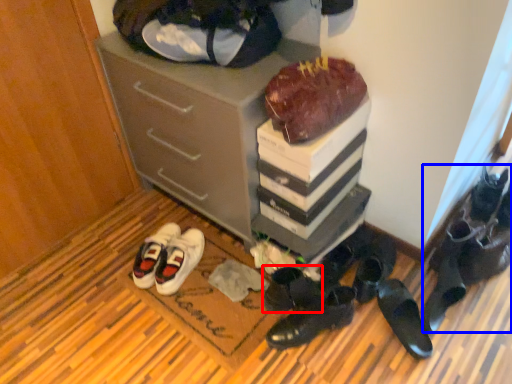
Question: Among these objects, which one is farthest to the camera, footwear (highlighted by a red box) or footwear (highlighted by a blue box)?

Choices:
 (A) footwear
 (B) footwear

Answer: (B)